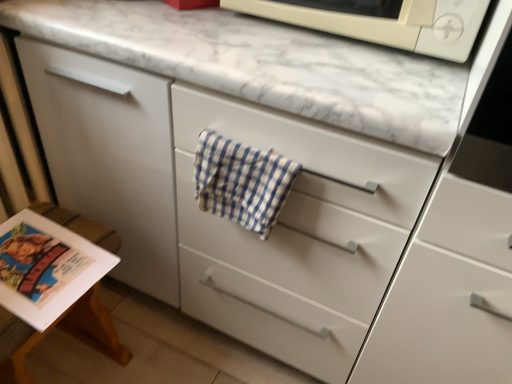
Where is `free spot in front of white matte microwave at upper center`? free spot in front of white matte microwave at upper center is located at coordinates (344, 77).